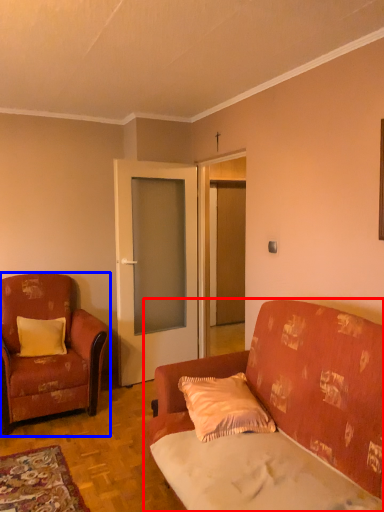
Question: Among these objects, which one is nearest to the camera, studio couch (highlighted by a red box) or chair (highlighted by a blue box)?

Choices:
 (A) studio couch
 (B) chair

Answer: (A)